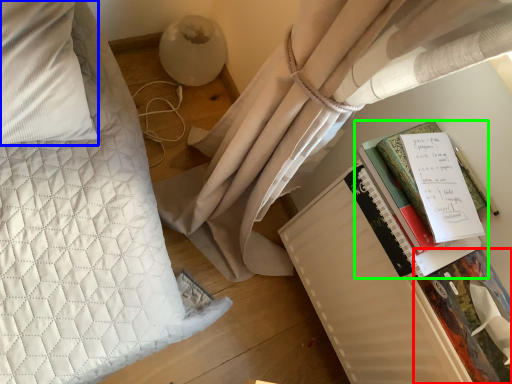
Question: Based on their relative distances, which object is farther from paperback book (highlighted by a red box)? Choose from pillow (highlighted by a blue box) and book (highlighted by a green box).

Choices:
 (A) pillow
 (B) book

Answer: (A)